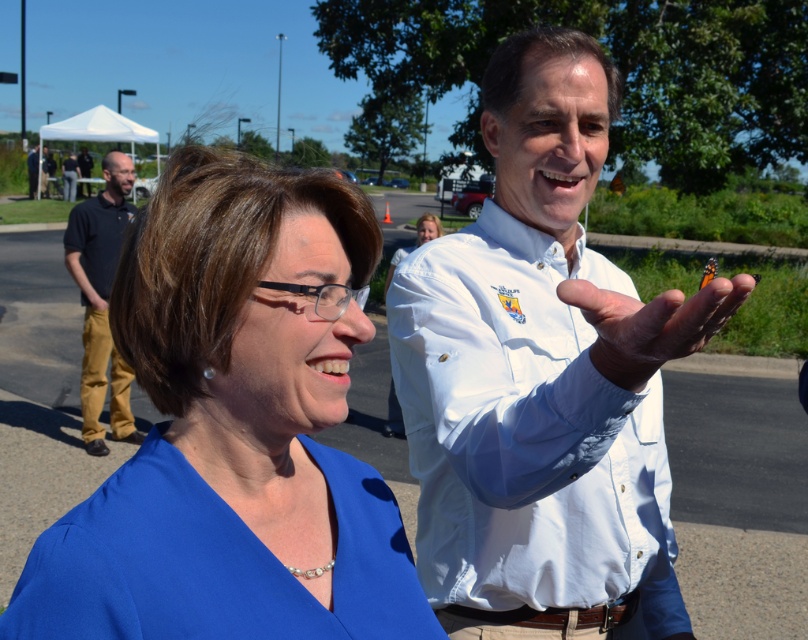
This screenshot has width=808, height=640. Describe the element at coordinates (234, 429) in the screenshot. I see `blue fabric dress at center` at that location.

Is point (368, 566) more distant than point (556, 330)?

No, (368, 566) is in front of (556, 330).

Identify the location of blue fabric dress at center. (234, 429).

The height and width of the screenshot is (640, 808). Find the location of `blue fabric dress at center`. blue fabric dress at center is located at coordinates (234, 429).

Between blue fabric dress at center and smooth white hand at center, which one is positioned higher?

smooth white hand at center is higher up.

Who is taller, blue fabric dress at center or smooth white hand at center?

blue fabric dress at center is taller.

Who is more forward, (377, 595) or (661, 310)?

Point (661, 310)

At what (x,y) coordinates should I click in order to perform the action: click on blue fabric dress at center. Please return your answer as a coordinate pair (x, y). The image size is (808, 640). Looking at the image, I should click on (234, 429).

Who is shorter, dark blue shirt at left or smooth white hand at center?

Standing shorter between the two is smooth white hand at center.

Which is below, dark blue shirt at left or smooth white hand at center?

Positioned lower is smooth white hand at center.

You are a GUI agent. You are given a task and a screenshot of the screen. Output one action in this format:
    pyautogui.click(x=<x>, y=<y>)
    Task: Click on the dark blue shirt at left
    Image resolution: width=808 pixels, height=640 pixels.
    Given the screenshot: What is the action you would take?
    pyautogui.click(x=101, y=300)